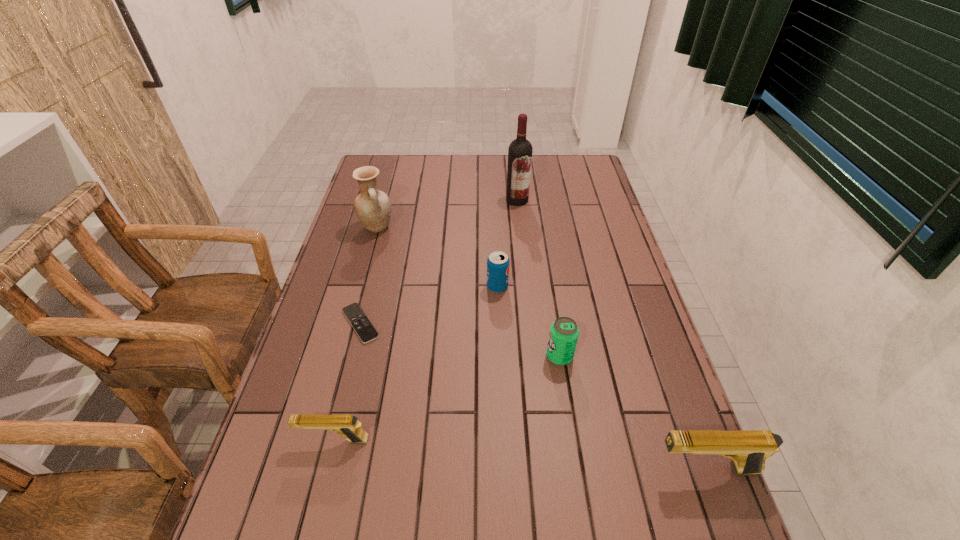
Find the location of `the right soda can`. the right soda can is located at coordinates (564, 332).

Locate an element on the screen. Image resolution: width=960 pixels, height=540 pixels. the nearer soda can is located at coordinates (564, 332).

The image size is (960, 540). What are the coordinates of `the farther soda can` in the screenshot? It's located at (498, 262).

Where is `the fifth nearest object`? The image size is (960, 540). the fifth nearest object is located at coordinates (498, 262).

At what (x,y) coordinates should I click in order to perform the action: click on blank area located at the barrel of the second shortest object. Please return your answer as a coordinate pair (x, y). Image resolution: width=960 pixels, height=540 pixels. Looking at the image, I should click on (268, 440).

Where is `free space located 0.120m at the barrel of the taller pistol`? This screenshot has height=540, width=960. free space located 0.120m at the barrel of the taller pistol is located at coordinates 594,469.

This screenshot has width=960, height=540. Find the location of `free region located at the barrel of the taller pistol`. free region located at the barrel of the taller pistol is located at coordinates (556, 469).

Find the location of a particular element. Image resolution: width=960 pixels, height=540 pixels. free space located 0.270m at the barrel of the taller pistol is located at coordinates (522, 469).

The height and width of the screenshot is (540, 960). What are the coordinates of `vacant space situated on the label of the farthest object` in the screenshot? It's located at (520, 228).

The width and height of the screenshot is (960, 540). I want to click on vacant point located on the right of the pottery, so click(x=485, y=227).